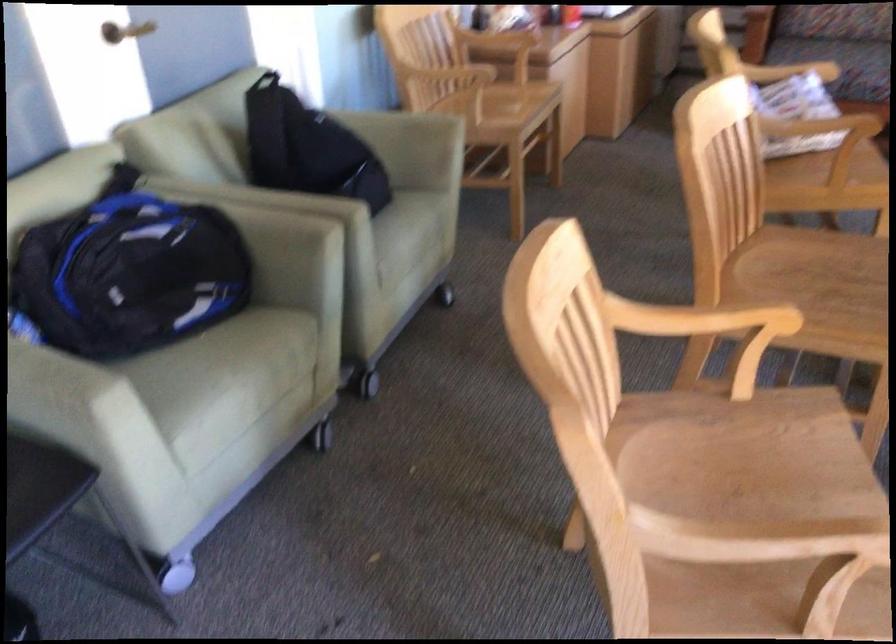
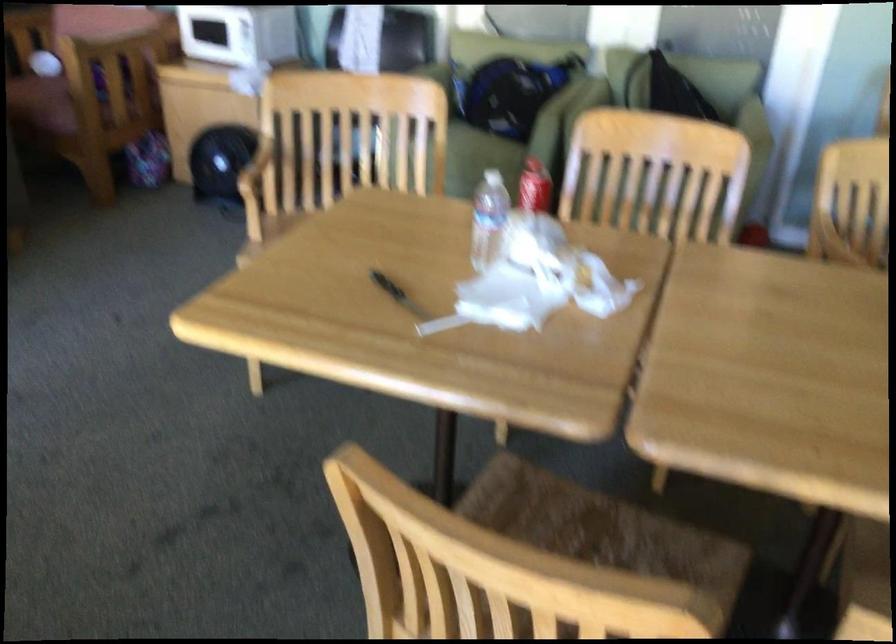
Question: I am providing you with two images of the same scene from different viewpoints. Which of the following objects are not visible in image2?

Choices:
 (A) red alarm clock
 (B) sofa sitting surface
 (C) chair sitting surface
 (D) plastic water bottle

Answer: (B)